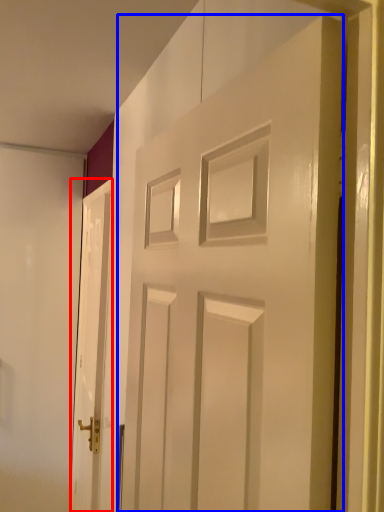
Question: Which object appears farthest to the camera in this image, door (highlighted by a red box) or door (highlighted by a blue box)?

Choices:
 (A) door
 (B) door

Answer: (A)